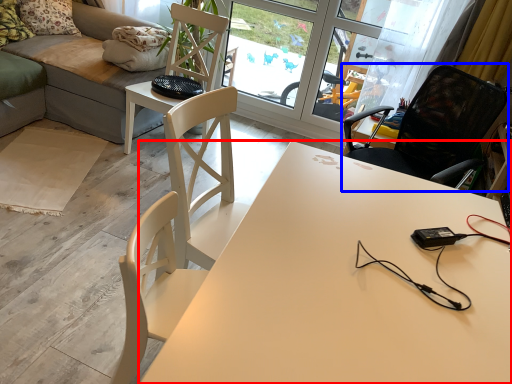
Question: Which point is closer to the camera, desk (highlighted by a red box) or chair (highlighted by a blue box)?

Choices:
 (A) desk
 (B) chair

Answer: (A)